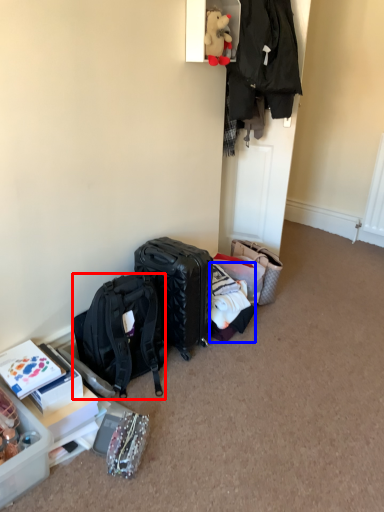
Question: Which object is closer to the camera taking this photo, backpack (highlighted by a red box) or clothing (highlighted by a blue box)?

Choices:
 (A) backpack
 (B) clothing

Answer: (A)